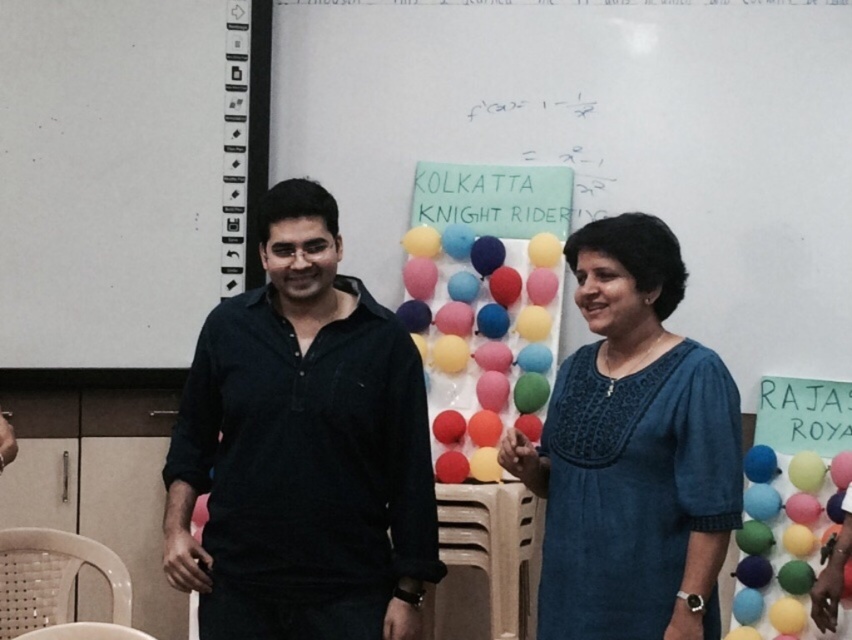
The height and width of the screenshot is (640, 852). What are the coordinates of `black cotton shirt at center` in the screenshot? It's located at (302, 449).

Does black cotton shirt at center have a greater height compared to white paper at upper left?

No, black cotton shirt at center is not taller than white paper at upper left.

Is point (209, 497) positioned before point (89, 168)?

Yes.

Locate an element on the screen. The height and width of the screenshot is (640, 852). black cotton shirt at center is located at coordinates (302, 449).

Does colorful balloons at center appear on the right side of white paper at upper left?

Correct, you'll find colorful balloons at center to the right of white paper at upper left.

Which of these two, colorful balloons at center or white paper at upper left, stands taller?

With more height is colorful balloons at center.

Identify the location of colorful balloons at center. This screenshot has height=640, width=852. (602, 140).

Is point (589, 44) in front of point (694, 596)?

No.

Does colorful balloons at center have a greater width compared to blue cotton dress at center?

Correct, the width of colorful balloons at center exceeds that of blue cotton dress at center.

Does point (504, 83) lie in front of point (726, 436)?

No, (504, 83) is further to viewer.

This screenshot has height=640, width=852. I want to click on colorful balloons at center, so click(x=602, y=140).